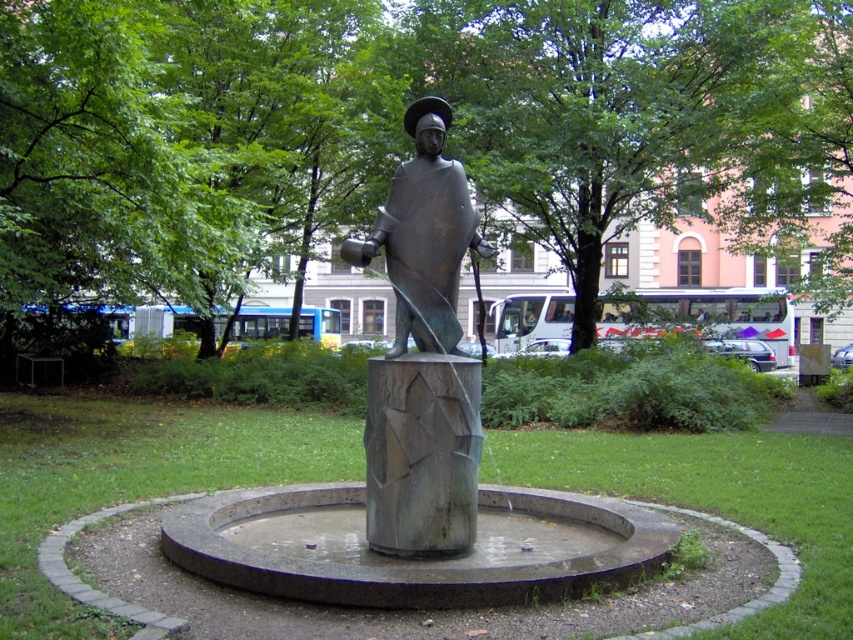
You are standing in the park and want to take a photo of the green leafy tree at center. If your camera has a maximum focus range of 8 meters, will it be able to capture the tree clearly?

The green leafy tree at center is 8.53 meters away from viewer. Since the camera can only focus up to 8 meters, it will not be able to capture the tree clearly.

You are standing at the point marked by point (399,131) in the park. Looking around, you see a green leafy tree at center. Which direction should you walk to reach the statue?

The point (399,131) indicates the green leafy tree at center, so you are already at the tree. The statue is in the central area, so you should walk away from the tree towards the center to reach the statue.